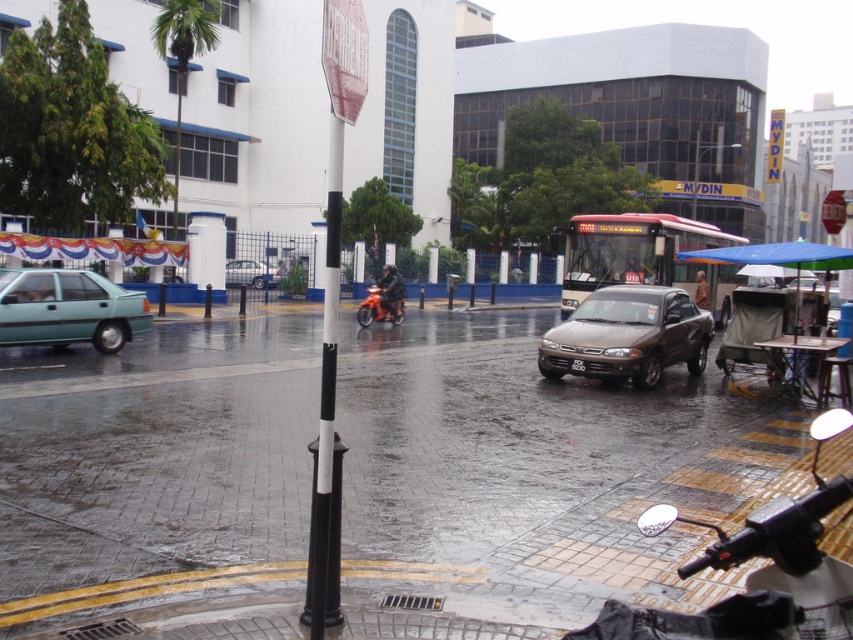
You are driving a teal matte sedan at left and want to turn right. Since the metallic silver car at center is blocking your path, can you safely move around it to make the turn?

The teal matte sedan at left is in front of the metallic silver car at center, so you can safely move around it to make the turn as long as there is enough space between them and traffic conditions permit.

You are a delivery person on a motorcycle and need to park your motorcycle between the light green car on the left and the brown sedan near the center. The parking spot is marked by a point at coordinates (380, 307). Can you park your motorcycle there?

The point at coordinates (380, 307) corresponds to the orange matte motorcycle at center, so the parking spot is already occupied by the motorcycle. You cannot park there.

You are a pedestrian standing on the wet pavement. You see an orange matte motorcycle at center and a metallic silver car at center. Which one is nearer to you?

The orange matte motorcycle at center is closer to the viewer than the metallic silver car at center.